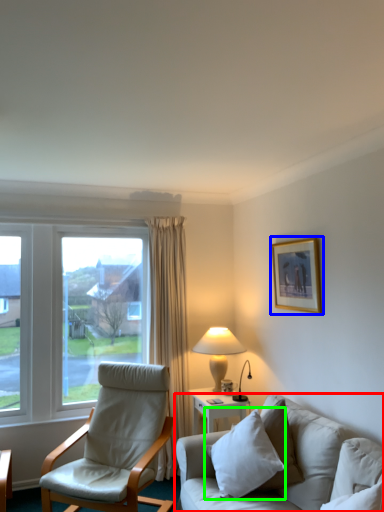
Question: Considering the real-world distances, which object is farthest from studio couch (highlighted by a red box)? picture frame (highlighted by a blue box) or pillow (highlighted by a green box)?

Choices:
 (A) picture frame
 (B) pillow

Answer: (A)